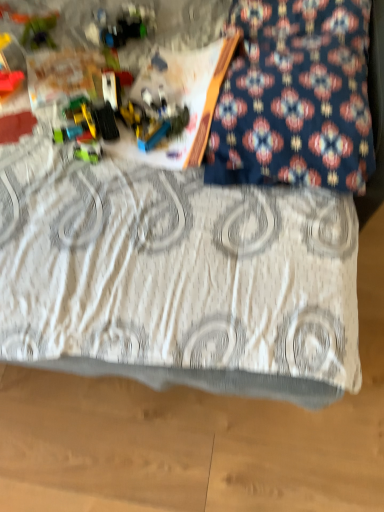
Question: Is green plastic toy at upper left, which is the 2th toy from top to bottom, facing towards shiny plastic toy at upper left, which is the 1th toy in top-to-bottom order?

Choices:
 (A) no
 (B) yes

Answer: (A)

Question: Is green plastic toy at upper left, arranged as the 2th toy when ordered from the bottom, further to the viewer compared to shiny plastic toy at upper left, which is the 1th toy in top-to-bottom order?

Choices:
 (A) yes
 (B) no

Answer: (A)

Question: Does green plastic toy at upper left, arranged as the 2th toy when ordered from the bottom, have a larger size compared to shiny plastic toy at upper left, which is the 1th toy in top-to-bottom order?

Choices:
 (A) yes
 (B) no

Answer: (B)

Question: From the image's perspective, is green plastic toy at upper left, which is the 2th toy from top to bottom, beneath shiny plastic toy at upper left, which is the 1th toy in top-to-bottom order?

Choices:
 (A) yes
 (B) no

Answer: (A)

Question: Is green plastic toy at upper left, which is the 2th toy from top to bottom, in contact with shiny plastic toy at upper left, the 3th toy when ordered from bottom to top?

Choices:
 (A) no
 (B) yes

Answer: (A)

Question: In terms of size, does white textured blanket at center appear bigger or smaller than translucent plastic construction set at upper left, positioned as the 3th toy in top-to-bottom order?

Choices:
 (A) small
 (B) big

Answer: (B)

Question: Would you say white textured blanket at center is to the left or to the right of translucent plastic construction set at upper left, the 1th toy in the bottom-to-top sequence, in the picture?

Choices:
 (A) right
 (B) left

Answer: (A)

Question: From the image's perspective, is white textured blanket at center above or below translucent plastic construction set at upper left, the 1th toy in the bottom-to-top sequence?

Choices:
 (A) below
 (B) above

Answer: (B)

Question: Considering the positions of white textured blanket at center and translucent plastic construction set at upper left, the 1th toy in the bottom-to-top sequence, in the image, is white textured blanket at center wider or thinner than translucent plastic construction set at upper left, the 1th toy in the bottom-to-top sequence,?

Choices:
 (A) thin
 (B) wide

Answer: (B)

Question: Is dark blue patterned pillow at upper right to the left or to the right of translucent plastic construction set at upper left, the 1th toy in the bottom-to-top sequence, in the image?

Choices:
 (A) left
 (B) right

Answer: (B)

Question: In terms of size, does dark blue patterned pillow at upper right appear bigger or smaller than translucent plastic construction set at upper left, positioned as the 3th toy in top-to-bottom order?

Choices:
 (A) small
 (B) big

Answer: (B)

Question: Which is correct: dark blue patterned pillow at upper right is inside translucent plastic construction set at upper left, the 1th toy in the bottom-to-top sequence, or outside of it?

Choices:
 (A) outside
 (B) inside

Answer: (A)

Question: From a real-world perspective, is dark blue patterned pillow at upper right positioned above or below translucent plastic construction set at upper left, positioned as the 3th toy in top-to-bottom order?

Choices:
 (A) below
 (B) above

Answer: (B)

Question: In the image, is green plastic toy at upper left, arranged as the 2th toy when ordered from the bottom, positioned in front of or behind white textured blanket at center?

Choices:
 (A) front
 (B) behind

Answer: (B)

Question: Is green plastic toy at upper left, which is the 2th toy from top to bottom, bigger or smaller than white textured blanket at center?

Choices:
 (A) big
 (B) small

Answer: (B)